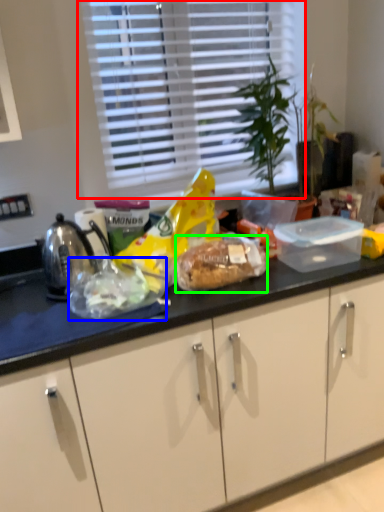
Question: Which object is the closest to the window (highlighted by a red box)? Choose among these: food (highlighted by a blue box) or snack (highlighted by a green box).

Choices:
 (A) food
 (B) snack

Answer: (B)